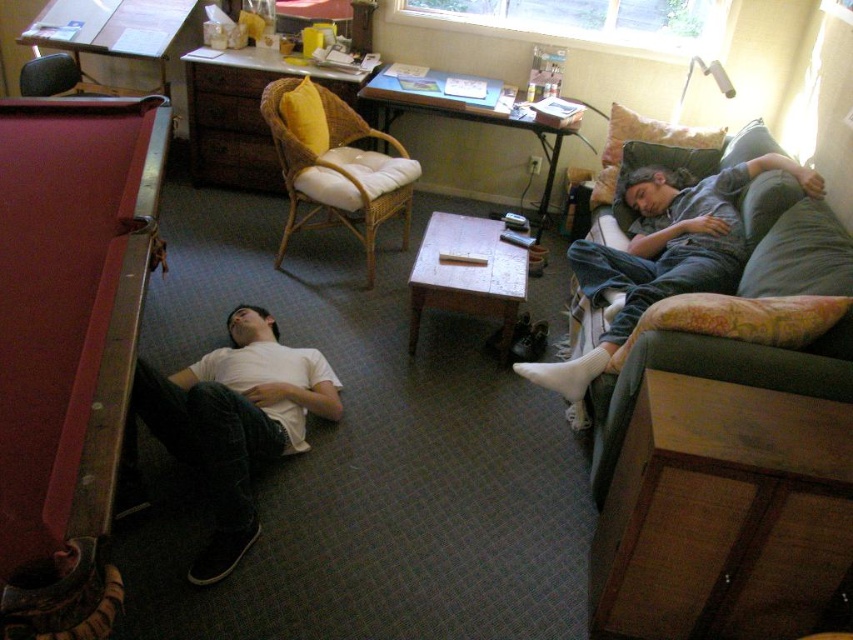
Can you confirm if white matte t-shirt at lower left is positioned to the left of woven wicker chair with white cushion at center?

Yes, white matte t-shirt at lower left is to the left of woven wicker chair with white cushion at center.

Is point (219, 404) positioned behind point (407, 186)?

That is False.

Identify the location of white matte t-shirt at lower left. (235, 422).

Is point (39, 376) behind point (218, 509)?

No, (39, 376) is in front of (218, 509).

Is maroon felt pool table at left above white matte t-shirt at lower left?

Yes, maroon felt pool table at left is above white matte t-shirt at lower left.

Between point (19, 442) and point (228, 426), which one is positioned in front?

Positioned in front is point (19, 442).

Where is `maroon felt pool table at left`? maroon felt pool table at left is located at coordinates (68, 307).

Is gray cotton pants at right shorter than matte black chair at upper left?

No.

Can you confirm if gray cotton pants at right is positioned below matte black chair at upper left?

Indeed, gray cotton pants at right is positioned under matte black chair at upper left.

The image size is (853, 640). Find the location of `gray cotton pants at right`. gray cotton pants at right is located at coordinates (660, 257).

Identify the location of gray cotton pants at right. The height and width of the screenshot is (640, 853). (660, 257).